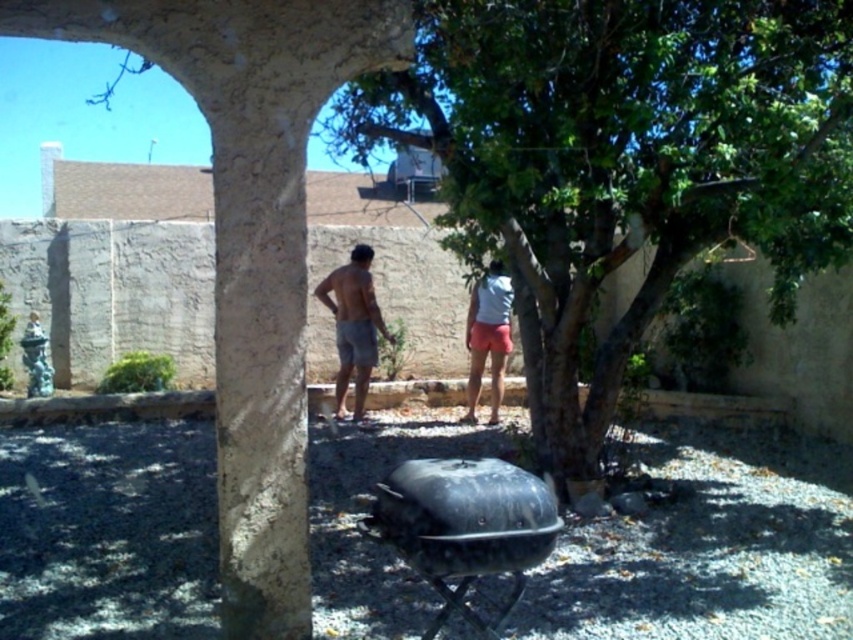
Between tan shorts at center and gray cotton shorts at center, which one is positioned lower?

gray cotton shorts at center is lower down.

Image resolution: width=853 pixels, height=640 pixels. What do you see at coordinates (354, 324) in the screenshot?
I see `tan shorts at center` at bounding box center [354, 324].

At what (x,y) coordinates should I click in order to perform the action: click on tan shorts at center. Please return your answer as a coordinate pair (x, y). The image size is (853, 640). Looking at the image, I should click on (354, 324).

Does green leafy tree at center appear on the right side of light blue fabric shirt at center?

Indeed, green leafy tree at center is positioned on the right side of light blue fabric shirt at center.

Between point (770, 202) and point (479, 332), which one is positioned behind?

Positioned behind is point (479, 332).

Locate an element on the screen. This screenshot has height=640, width=853. green leafy tree at center is located at coordinates (619, 161).

Locate an element on the screen. The width and height of the screenshot is (853, 640). gray cotton shorts at center is located at coordinates (352, 324).

Does point (379, 310) come farther from viewer compared to point (497, 262)?

Yes, it is.

Locate an element on the screen. Image resolution: width=853 pixels, height=640 pixels. gray cotton shorts at center is located at coordinates (352, 324).